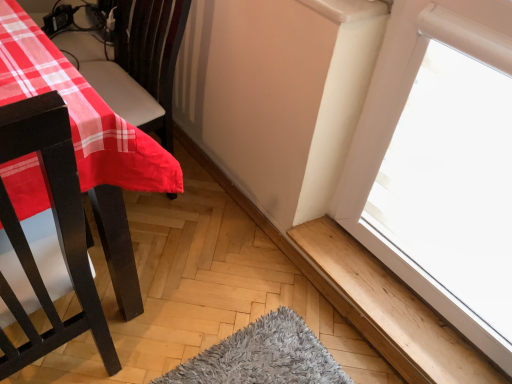
Question: Is wooden at lower right in front of or behind matte plastic table at left in the image?

Choices:
 (A) behind
 (B) front

Answer: (A)

Question: Visually, is wooden at lower right positioned to the left or to the right of matte plastic table at left?

Choices:
 (A) left
 (B) right

Answer: (B)

Question: Considering the positions of wooden at lower right and matte plastic table at left in the image, is wooden at lower right taller or shorter than matte plastic table at left?

Choices:
 (A) short
 (B) tall

Answer: (A)

Question: From the image's perspective, relative to wooden at lower right, is matte plastic table at left above or below?

Choices:
 (A) above
 (B) below

Answer: (A)

Question: Is matte plastic table at left wider or thinner than wooden at lower right?

Choices:
 (A) thin
 (B) wide

Answer: (B)

Question: In terms of size, does matte plastic table at left appear bigger or smaller than wooden at lower right?

Choices:
 (A) big
 (B) small

Answer: (A)

Question: Is point 2,61 positioned closer to the camera than point 397,288?

Choices:
 (A) closer
 (B) farther

Answer: (A)